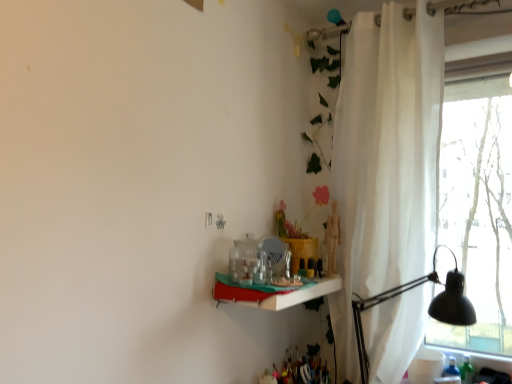
Find the location of a particular element. The width and height of the screenshot is (512, 384). white glossy shelf at center is located at coordinates (276, 294).

Measure the distance between point [320,281] and camera.

They are 5.71 feet apart.

The height and width of the screenshot is (384, 512). What are the coordinates of `white glossy shelf at center` in the screenshot? It's located at (276, 294).

Is white glossy shelf at center at the back of black metal table lamp at right?

No, black metal table lamp at right is not facing away from white glossy shelf at center.

From the image's perspective, would you say black metal table lamp at right is shown under white glossy shelf at center?

Yes, from the image's perspective, black metal table lamp at right is below white glossy shelf at center.

Considering the sizes of black metal table lamp at right and white glossy shelf at center in the image, is black metal table lamp at right bigger or smaller than white glossy shelf at center?

Considering their sizes, black metal table lamp at right takes up more space than white glossy shelf at center.

Which object is closer to the camera, black metal table lamp at right or white glossy shelf at center?

white glossy shelf at center.

Can you confirm if white sheer curtain at right is positioned to the right of white glossy shelf at center?

Yes.

Does white sheer curtain at right turn towards white glossy shelf at center?

Yes, white sheer curtain at right faces towards white glossy shelf at center.

Does point (392, 366) appear closer or farther from the camera than point (319, 281)?

Point (392, 366) is farther from the camera than point (319, 281).

Considering the sizes of white sheer curtain at right and white glossy shelf at center in the image, is white sheer curtain at right bigger or smaller than white glossy shelf at center?

Clearly, white sheer curtain at right is larger in size than white glossy shelf at center.

Is point (466, 303) closer or farther from the camera than point (367, 166)?

Point (466, 303) is positioned closer to the camera compared to point (367, 166).

Which object is wider, black metal table lamp at right or white sheer curtain at right?

With larger width is black metal table lamp at right.

Is black metal table lamp at right oriented away from white sheer curtain at right?

Absolutely, black metal table lamp at right is directed away from white sheer curtain at right.

Who is bigger, black metal table lamp at right or white sheer curtain at right?

Bigger between the two is white sheer curtain at right.

Does point (232, 300) come in front of point (438, 25)?

Yes, point (232, 300) is closer to viewer.

Is white glossy shelf at center taller than white sheer curtain at right?

In fact, white glossy shelf at center may be shorter than white sheer curtain at right.

In the scene shown: Is white glossy shelf at center in contact with white sheer curtain at right?

No, white glossy shelf at center is not touching white sheer curtain at right.

From a real-world perspective, who is located higher, white glossy shelf at center or white sheer curtain at right?

white sheer curtain at right, from a real-world perspective.

Looking at this image, which object is closer to the camera taking this photo, white sheer curtain at right or black metal table lamp at right?

black metal table lamp at right is closer to the camera.

Measure the distance between white sheer curtain at right and black metal table lamp at right.

white sheer curtain at right and black metal table lamp at right are 14.08 inches apart from each other.

Considering the sizes of objects white sheer curtain at right and black metal table lamp at right in the image provided, who is smaller, white sheer curtain at right or black metal table lamp at right?

black metal table lamp at right is smaller.

Is black metal table lamp at right located within white sheer curtain at right?

Absolutely, black metal table lamp at right is inside white sheer curtain at right.

Could black metal table lamp at right be considered to be inside white glossy shelf at center?

No, black metal table lamp at right is not a part of white glossy shelf at center.

Is white glossy shelf at center facing towards black metal table lamp at right?

No, white glossy shelf at center is not facing towards black metal table lamp at right.

Can you confirm if white glossy shelf at center is thinner than black metal table lamp at right?

Yes.

Who is bigger, white glossy shelf at center or black metal table lamp at right?

With larger size is black metal table lamp at right.

Identify the location of table lamp below the white glossy shelf at center (from a real-world perspective). (428, 309).

Identify the location of curtain that is on the right side of white glossy shelf at center. Image resolution: width=512 pixels, height=384 pixels. (386, 159).

Which object lies nearer to the anchor point white glossy shelf at center, black metal table lamp at right or white sheer curtain at right?

black metal table lamp at right is closer to white glossy shelf at center.

From the image, which object appears to be farther from white sheer curtain at right, white glossy shelf at center or black metal table lamp at right?

white glossy shelf at center lies further to white sheer curtain at right than the other object.

From the image, which object appears to be farther from white sheer curtain at right, black metal table lamp at right or white glossy shelf at center?

Among the two, white glossy shelf at center is located further to white sheer curtain at right.

Considering their positions, is white sheer curtain at right positioned further to black metal table lamp at right than white glossy shelf at center?

white glossy shelf at center.

Considering their positions, is white glossy shelf at center positioned further to black metal table lamp at right than white sheer curtain at right?

Based on the image, white glossy shelf at center appears to be further to black metal table lamp at right.

Consider the image. Considering their positions, is white sheer curtain at right positioned further to white glossy shelf at center than black metal table lamp at right?

white sheer curtain at right is further to white glossy shelf at center.

At what (x,y) coordinates should I click in order to perform the action: click on shelf between white sheer curtain at right and black metal table lamp at right in the up-down direction. Please return your answer as a coordinate pair (x, y). This screenshot has width=512, height=384. Looking at the image, I should click on (276, 294).